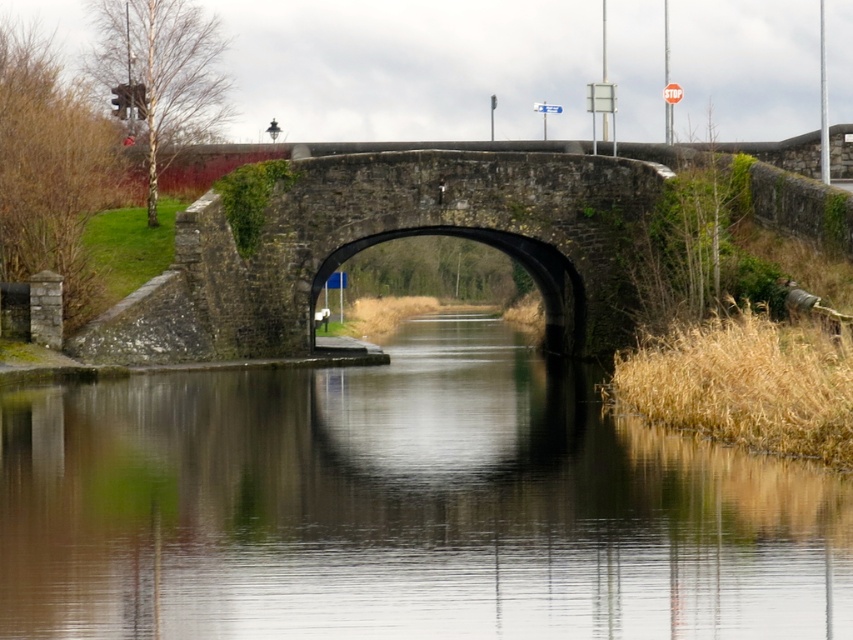
Question: Can you confirm if smooth brown water at center is positioned below stone arch bridge at center?

Choices:
 (A) yes
 (B) no

Answer: (A)

Question: Which of the following is the closest to the observer?

Choices:
 (A) (604, 513)
 (B) (351, 196)

Answer: (A)

Question: Is smooth brown water at center positioned at the back of stone arch bridge at center?

Choices:
 (A) no
 (B) yes

Answer: (A)

Question: Can you confirm if smooth brown water at center is thinner than stone arch bridge at center?

Choices:
 (A) yes
 (B) no

Answer: (B)